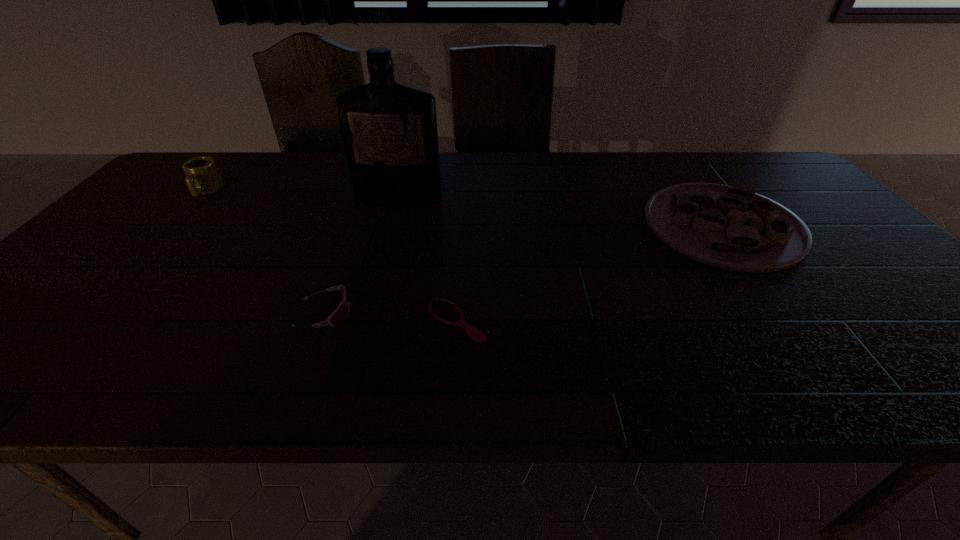
Image resolution: width=960 pixels, height=540 pixels. I want to click on vacant space that is in between the second tallest object and the fourth tallest object, so click(x=266, y=252).

In order to click on the fourth closest object relative to the mug in this screenshot , I will do `click(733, 228)`.

Select which object appears as the closest to the platter. Please provide its 2D coordinates. Your answer should be formatted as a tuple, i.e. [(x, y)], where the tuple contains the x and y coordinates of a point satisfying the conditions above.

[(446, 312)]

The image size is (960, 540). I want to click on free space that satisfies the following two spatial constraints: 1. with the handle on the side of the platter; 2. on the left side of the leftmost object, so click(175, 226).

Where is `free space in the image that satisfies the following two spatial constraints: 1. on the front-facing side of the shortest object; 2. on the right side of the goggles`? free space in the image that satisfies the following two spatial constraints: 1. on the front-facing side of the shortest object; 2. on the right side of the goggles is located at coordinates (322, 321).

Find the location of a particular element. This screenshot has height=540, width=960. blank space that satisfies the following two spatial constraints: 1. on the label side of the tallest object; 2. on the front-facing side of the goggles is located at coordinates (369, 313).

You are a GUI agent. You are given a task and a screenshot of the screen. Output one action in this format:
    pyautogui.click(x=<x>, y=<y>)
    Task: Click on the vacant region that satisfies the following two spatial constraints: 1. on the back side of the rightmost object; 2. on the right side of the second object from right to left
    The image size is (960, 540).
    Given the screenshot: What is the action you would take?
    pyautogui.click(x=462, y=226)

In order to click on free spot that satisfies the following two spatial constraints: 1. on the label side of the tallest object; 2. on the front-facing side of the second shortest object in this screenshot , I will do `click(369, 313)`.

Locate an element on the screen. This screenshot has width=960, height=540. vacant space that satisfies the following two spatial constraints: 1. with the handle on the side of the second object from right to left; 2. on the left side of the mug is located at coordinates (87, 321).

Find the location of a particular element. The width and height of the screenshot is (960, 540). blank area in the image that satisfies the following two spatial constraints: 1. on the label side of the liquor; 2. on the front-facing side of the second shortest object is located at coordinates (369, 313).